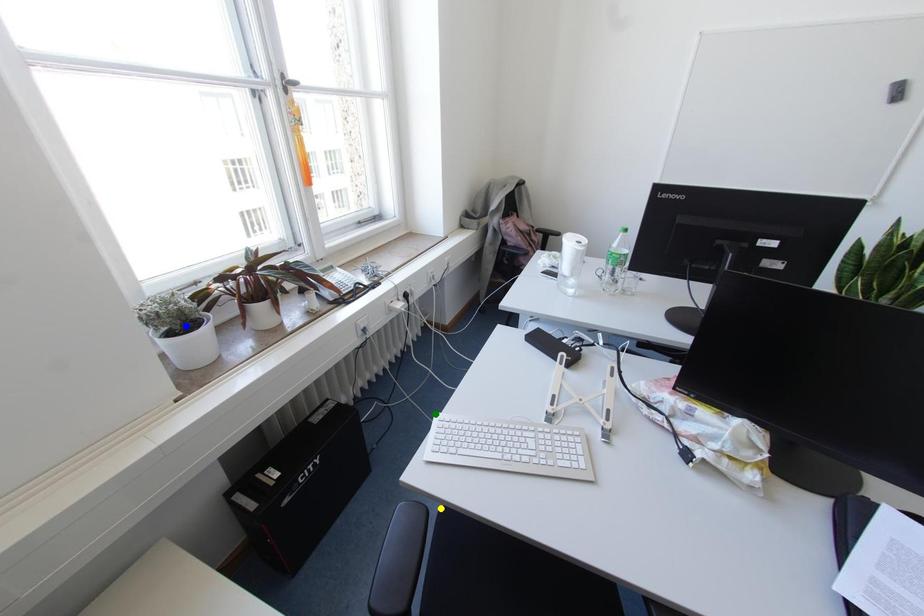
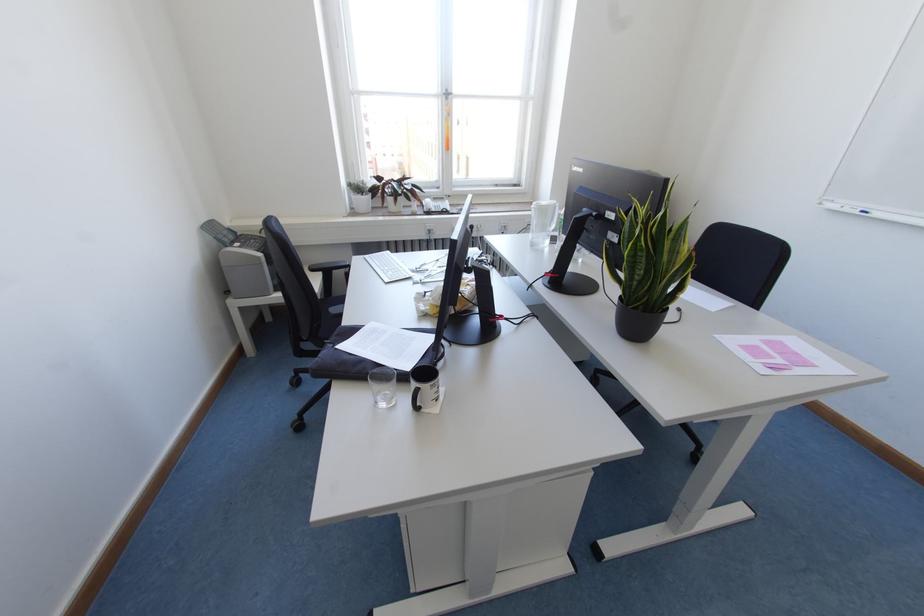
I am providing you with two images of the same scene from different viewpoints. Three points are marked in image1. Which point corresponds to a part or object that is occluded in image2?In image1, three points are marked. Which of them correspond to a part or object that is occluded in image2?Among the three points shown in image1, which one corresponds to a part or object that is no longer visible due to occlusion in image2?

Invisible in image2: yellow point.